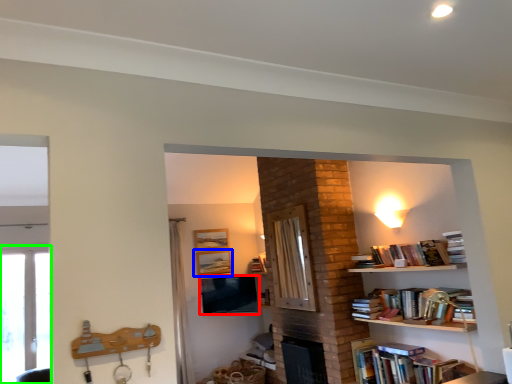
Question: Based on their relative distances, which object is nearer to television (highlighted by a red box)? Choose from picture frame (highlighted by a blue box) and window (highlighted by a green box).

Choices:
 (A) picture frame
 (B) window

Answer: (A)